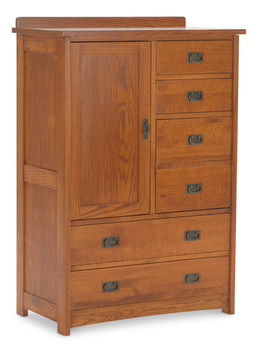
Where is `the top compartment`? Image resolution: width=258 pixels, height=360 pixels. the top compartment is located at coordinates (165, 63), (166, 87).